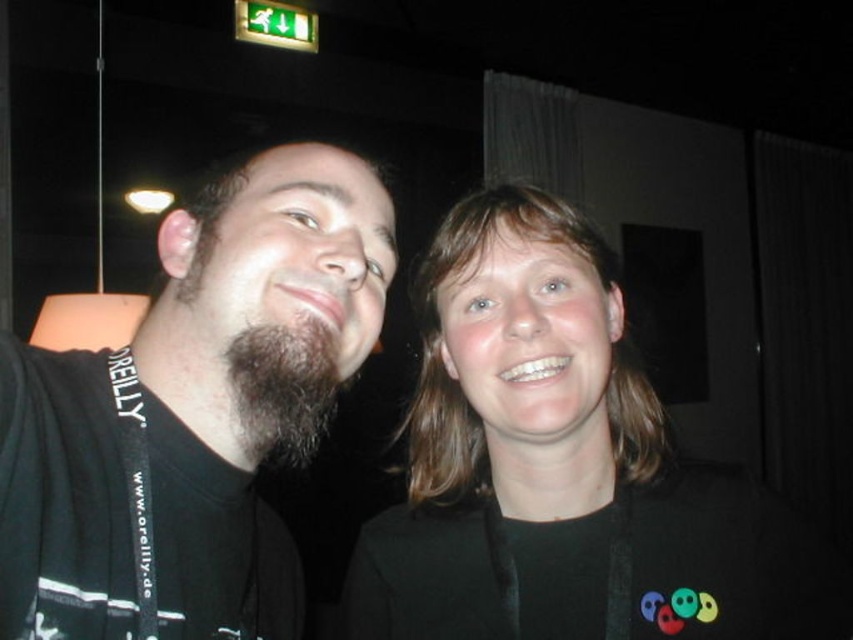
Question: Is black fabric at center below dark brown fuzzy beard at center?

Choices:
 (A) yes
 (B) no

Answer: (B)

Question: Can you confirm if black fabric at center is thinner than dark brown fuzzy beard at center?

Choices:
 (A) yes
 (B) no

Answer: (B)

Question: Observing the image, what is the correct spatial positioning of black fabric at center in reference to dark brown fuzzy beard at center?

Choices:
 (A) above
 (B) below

Answer: (A)

Question: Which point is closer to the camera?

Choices:
 (A) black matte t-shirt at left
 (B) dark brown fuzzy beard at center

Answer: (A)

Question: Which point is closer to the camera taking this photo?

Choices:
 (A) (608, 509)
 (B) (38, 460)

Answer: (B)

Question: Considering the real-world distances, which object is farthest from the black fabric at center?

Choices:
 (A) black matte t-shirt at left
 (B) dark brown fuzzy beard at center

Answer: (B)